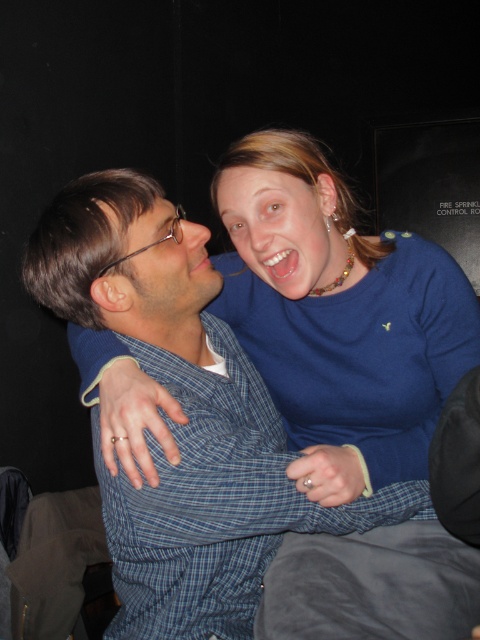
Is blue fabric face at upper right thinner than matte blue shirt at center?

No.

Can you confirm if blue fabric face at upper right is bigger than matte blue shirt at center?

Yes, blue fabric face at upper right is bigger than matte blue shirt at center.

Identify the location of blue fabric face at upper right. (282, 227).

This screenshot has height=640, width=480. I want to click on blue fabric face at upper right, so click(282, 227).

Does blue fabric shirt at upper center lie behind matte blue shirt at center?

No, it is not.

What do you see at coordinates (337, 316) in the screenshot?
I see `blue fabric shirt at upper center` at bounding box center [337, 316].

This screenshot has height=640, width=480. What are the coordinates of `blue fabric shirt at upper center` in the screenshot? It's located at (337, 316).

Is blue fabric shirt at upper center to the right of blue fabric face at upper right from the viewer's perspective?

No, blue fabric shirt at upper center is not to the right of blue fabric face at upper right.

Looking at this image, is blue fabric shirt at upper center smaller than blue fabric face at upper right?

Actually, blue fabric shirt at upper center might be larger than blue fabric face at upper right.

This screenshot has height=640, width=480. I want to click on blue fabric shirt at upper center, so click(337, 316).